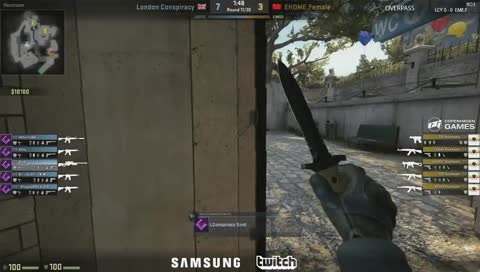
The height and width of the screenshot is (272, 480). What are the coordinates of `knife handle` in the screenshot? It's located at (332, 174).